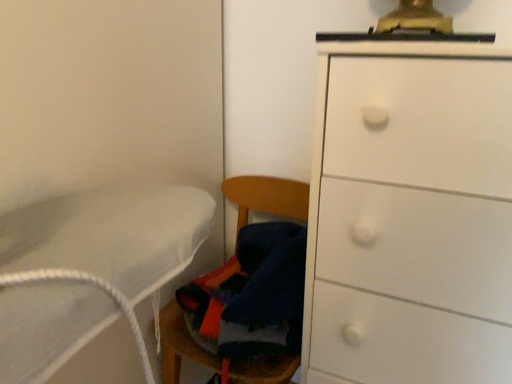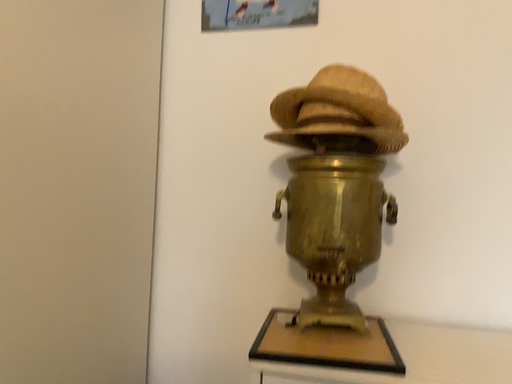
Question: Which way did the camera rotate in the video?

Choices:
 (A) rotated upward
 (B) rotated downward

Answer: (A)